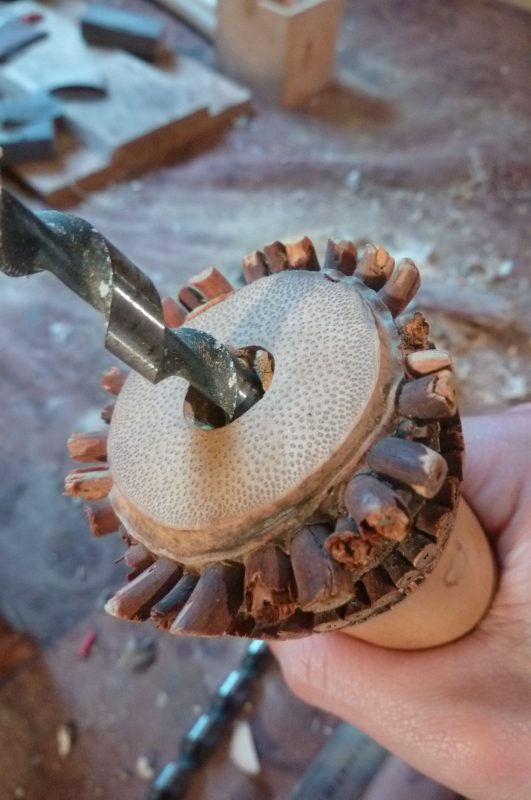
Image resolution: width=531 pixels, height=800 pixels. I want to click on brown box, so click(x=296, y=30).